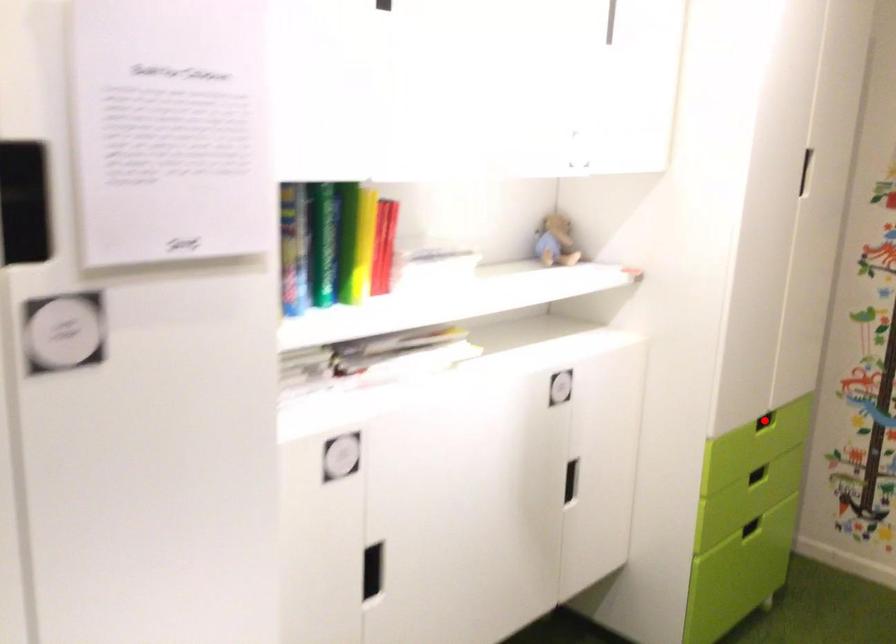
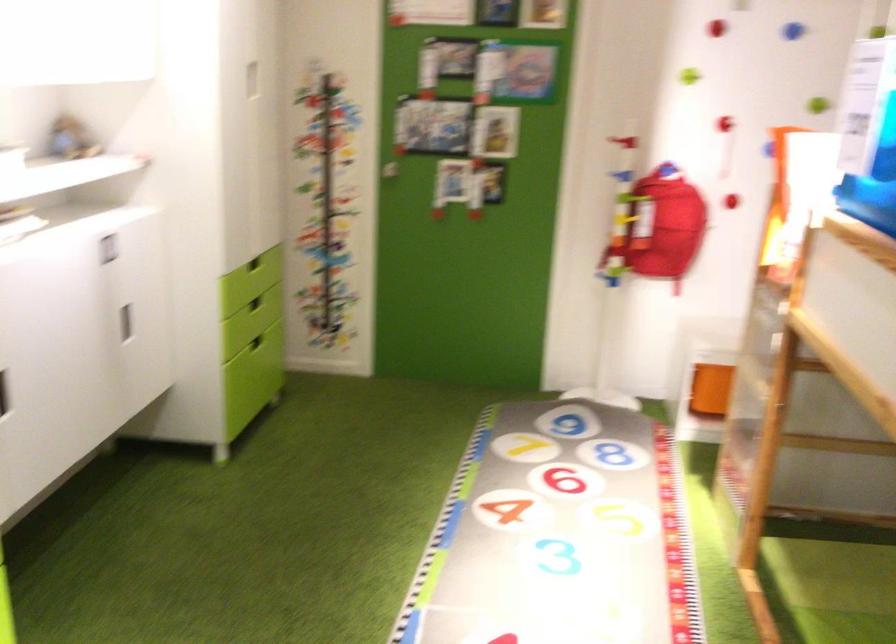
In the second image, find the point that corresponds to the highlighted location in the first image.

(254, 263)